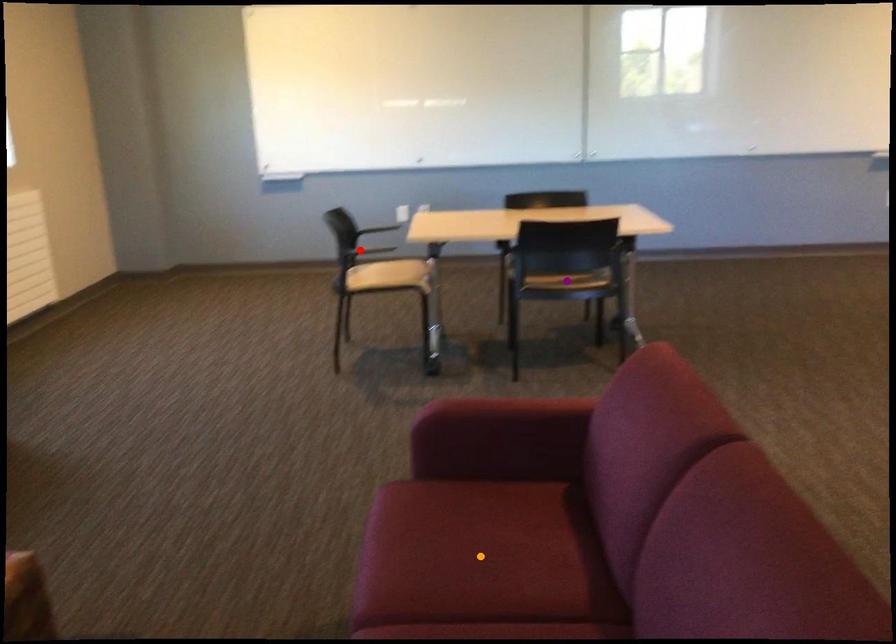
Order these from nearest to farthest:
- red point
- purple point
- orange point

orange point, purple point, red point